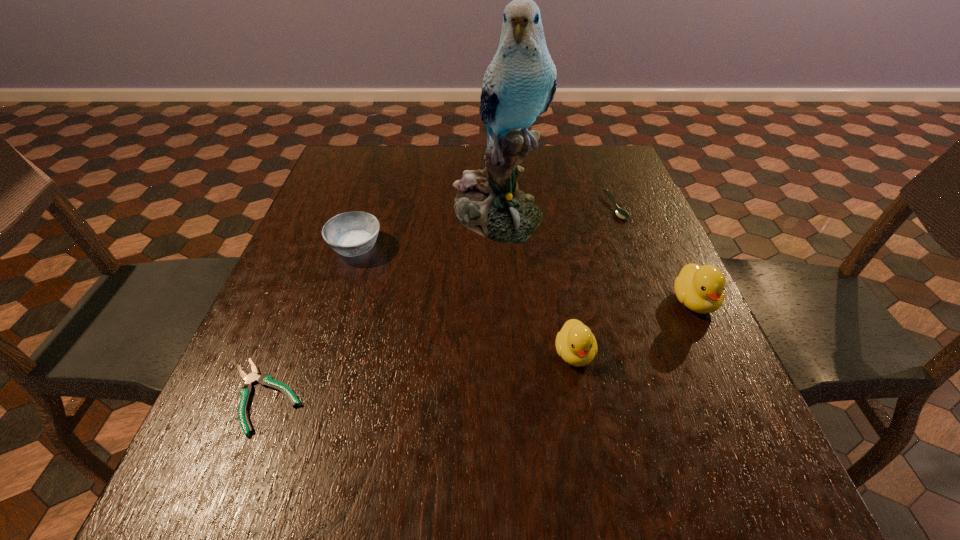
The width and height of the screenshot is (960, 540). I want to click on soupspoon at the right edge, so click(x=619, y=212).

The image size is (960, 540). Find the location of `object that is positioned at the near left corner`. object that is positioned at the near left corner is located at coordinates (246, 390).

Image resolution: width=960 pixels, height=540 pixels. I want to click on vacant space at the far edge of the desktop, so (425, 164).

Locate an element on the screen. free space at the near edge is located at coordinates (351, 405).

This screenshot has width=960, height=540. In the image, there is a desktop. Identify the location of vacant space at the left edge. (284, 292).

Find the location of `vacant space at the right edge of the desktop`. vacant space at the right edge of the desktop is located at coordinates (697, 355).

I want to click on vacant position at the far left corner of the desktop, so click(372, 176).

In the image, there is a desktop. Identify the location of vacant space at the far right corner. (616, 156).

You are a GUI agent. You are given a task and a screenshot of the screen. Output one action in this format:
    pyautogui.click(x=<x>, y=<y>)
    Task: Click on the vacant space at the near right corner
    This screenshot has height=540, width=960.
    Given the screenshot: What is the action you would take?
    pyautogui.click(x=686, y=395)

Identify the location of free spot between the ashtray and the left duckling. The image size is (960, 540). (465, 300).